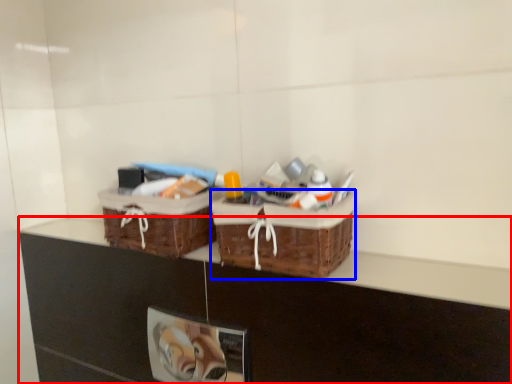
Question: Among these objects, which one is nearest to the camera, counter (highlighted by a red box) or picnic basket (highlighted by a blue box)?

Choices:
 (A) counter
 (B) picnic basket

Answer: (A)